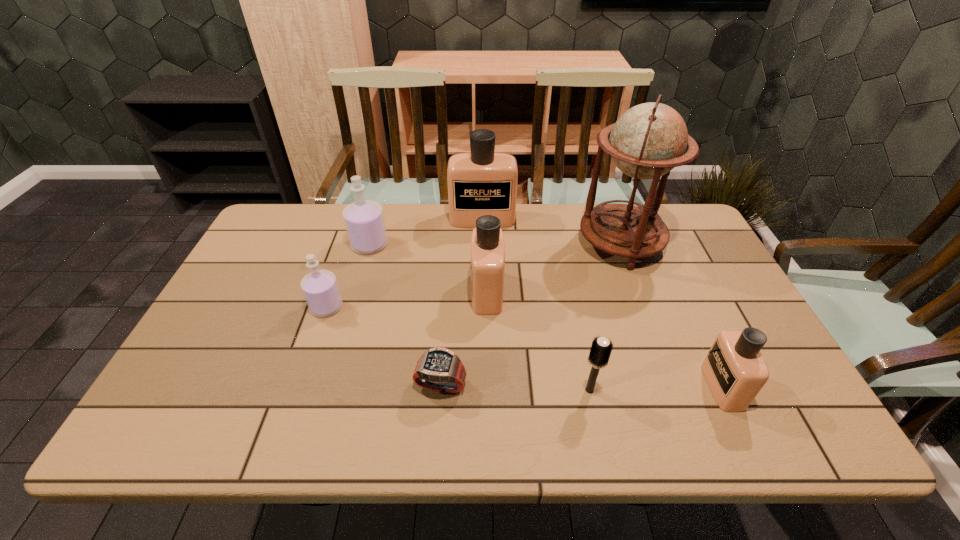
Where is `vacant space situated 0.120m on the front of the smaller purple perfume`? The height and width of the screenshot is (540, 960). vacant space situated 0.120m on the front of the smaller purple perfume is located at coordinates (310, 356).

Image resolution: width=960 pixels, height=540 pixels. I want to click on free space located on the front label of the nearest beige perfume, so click(660, 387).

Identify the location of vacant space located 0.170m on the front label of the nearest beige perfume. The height and width of the screenshot is (540, 960). (634, 387).

Identify the location of vacant point located on the front label of the nearest beige perfume. The height and width of the screenshot is (540, 960). [x=660, y=387].

Find the location of a particular element. The width and height of the screenshot is (960, 540). vacant space located on the right of the sixth object from left to right is located at coordinates (696, 390).

Image resolution: width=960 pixels, height=540 pixels. Identify the location of vacant space situated on the right of the shortest object. (611, 384).

Locate an element on the screen. Image resolution: width=960 pixels, height=540 pixels. globe that is at the far edge is located at coordinates (650, 139).

At what (x,y) coordinates should I click in order to perform the action: click on object positioned at the near edge. Please return your answer as a coordinate pair (x, y). Looking at the image, I should click on (735, 371).

This screenshot has height=540, width=960. I want to click on globe located at the right edge, so click(650, 139).

Locate an element on the screen. The image size is (960, 540). perfume that is positioned at the right edge is located at coordinates (735, 371).